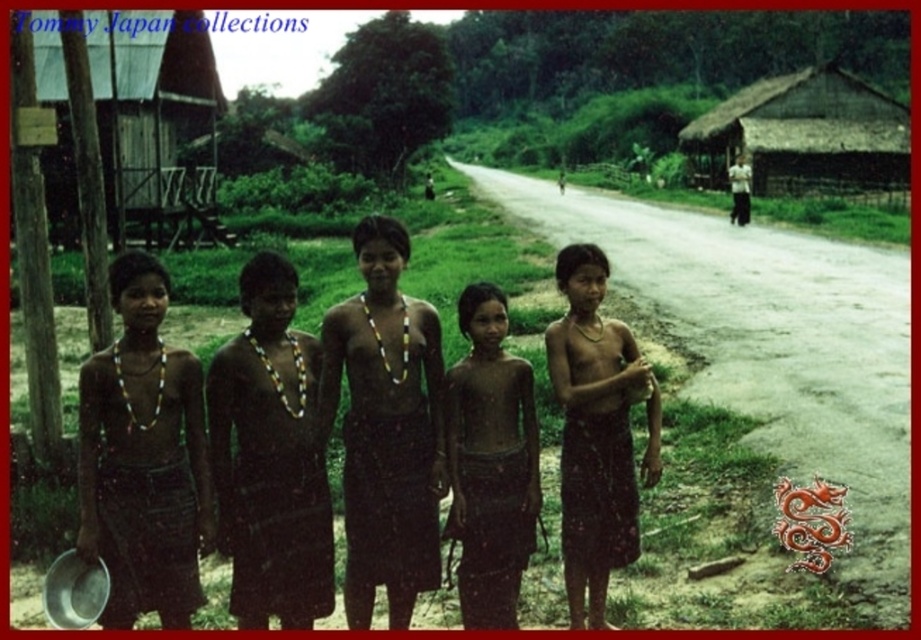
Is dark brown skin at center above thatched brown hut at upper right?

No, dark brown skin at center is not above thatched brown hut at upper right.

Between point (278, 500) and point (902, 161), which one is positioned in front?

Point (278, 500)

Image resolution: width=921 pixels, height=640 pixels. Find the location of `dark brown skin at center`. dark brown skin at center is located at coordinates (x=270, y=458).

Is brown woven skirt at center further to camera compared to thatched brown hut at upper right?

That is False.

Who is shorter, brown woven skirt at center or thatched brown hut at upper right?

brown woven skirt at center

The image size is (921, 640). I want to click on brown woven skirt at center, so click(x=597, y=433).

Image resolution: width=921 pixels, height=640 pixels. In order to click on brown woven skirt at center in this screenshot , I will do `click(597, 433)`.

Can you confirm if gray asphalt road at center is positioned above brown woven skirt at left?

Indeed, gray asphalt road at center is positioned over brown woven skirt at left.

Is gray asphalt road at center behind brown woven skirt at left?

Yes, it is behind brown woven skirt at left.

I want to click on gray asphalt road at center, so 770,346.